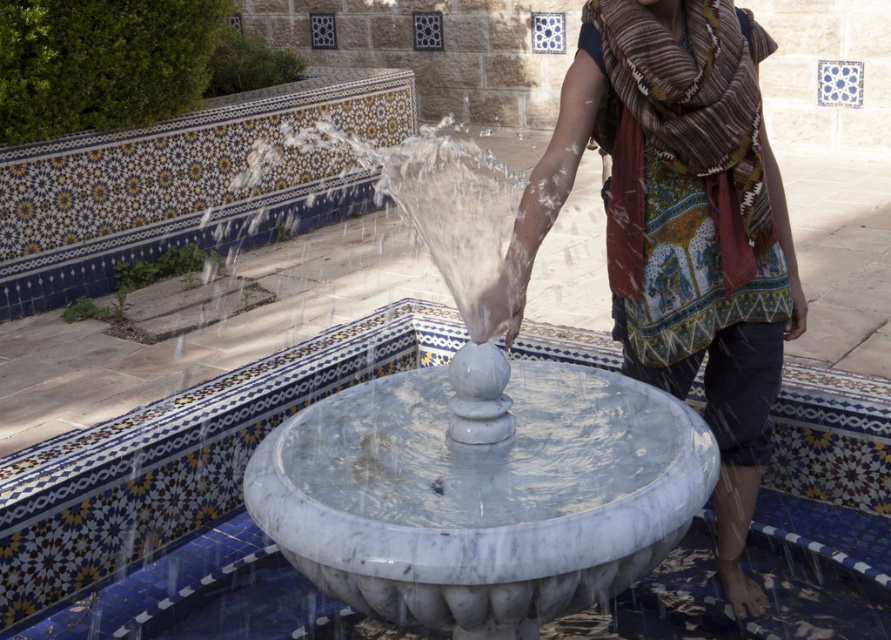
You are standing in the courtyard and see the white marble fountain at center and the patterned scarf at center. Which object is positioned to the left?

The white marble fountain at center is to the left of the patterned scarf at center.

You are a photographer planning to capture the white marble fountain at center and the patterned scarf at center in a single frame. Based on their sizes, which object should you focus on to ensure both are fully visible without cropping?

The white marble fountain at center is wider than the patterned scarf at center, so you should focus on the white marble fountain at center to ensure both are fully visible without cropping.